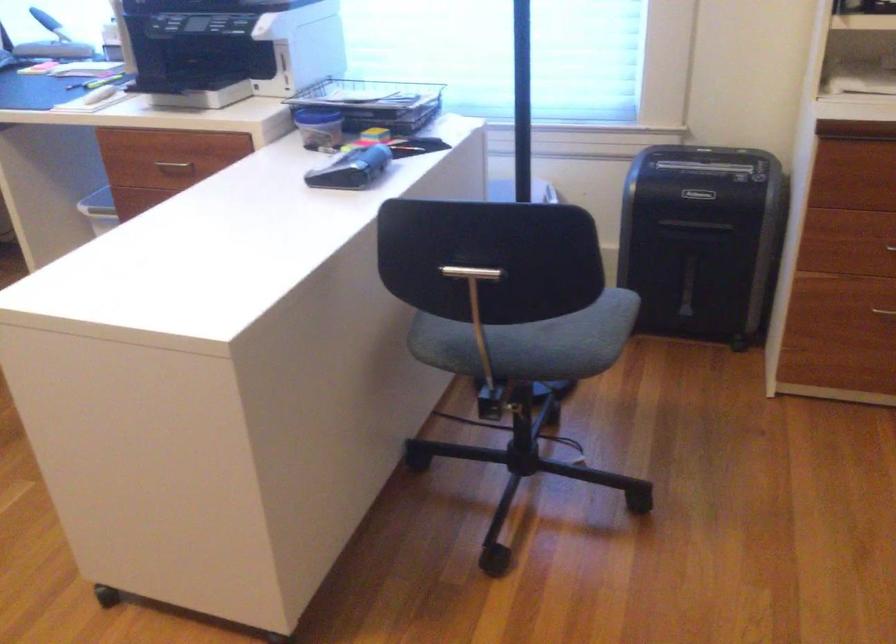
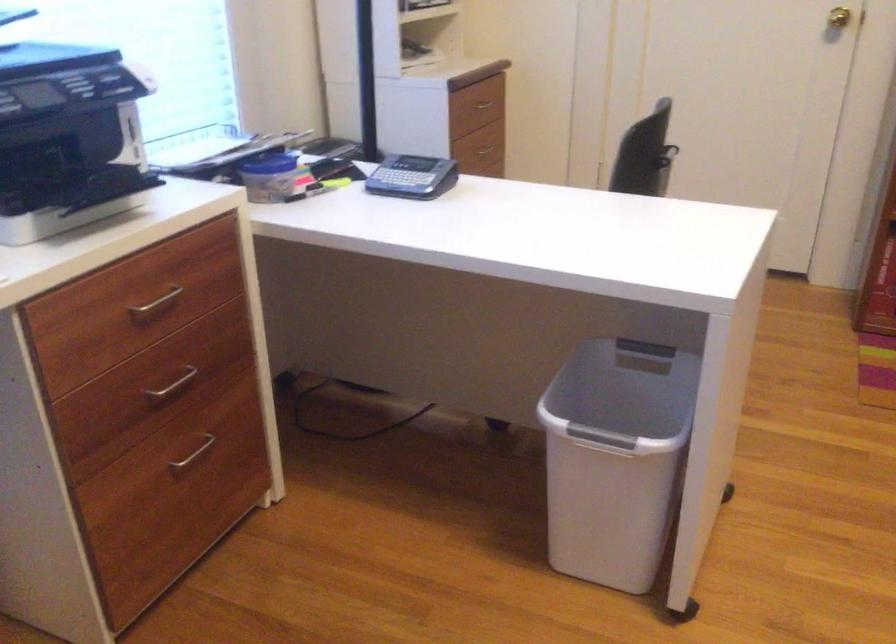
Question: I am providing you with two images of the same scene from different viewpoints. Which of the following objects are not visible in image2?

Choices:
 (A) shredder bin handle
 (B) brass doorknob
 (C) metal drawer handle
 (D) white appliance button

Answer: (A)